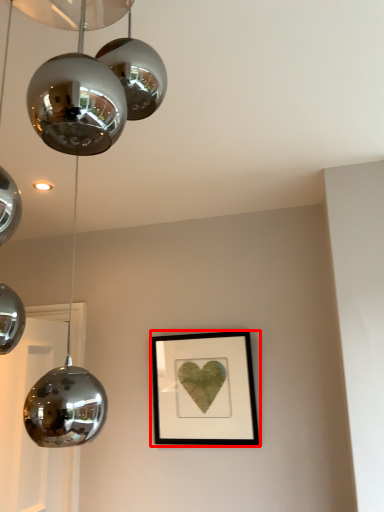
Question: From the image's perspective, what is the correct spatial positioning of picture frame (annotated by the red box) in reference to lamp?

Choices:
 (A) below
 (B) above

Answer: (A)